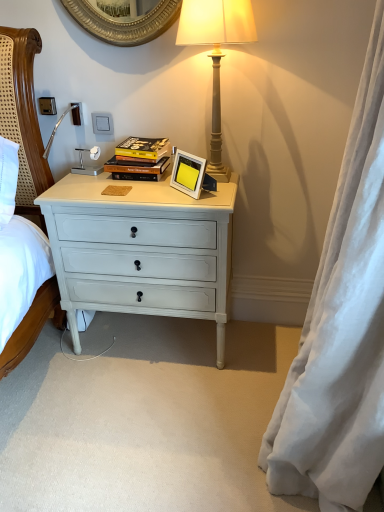
Identify the location of free location in front of wooden picture frame at center. (195, 196).